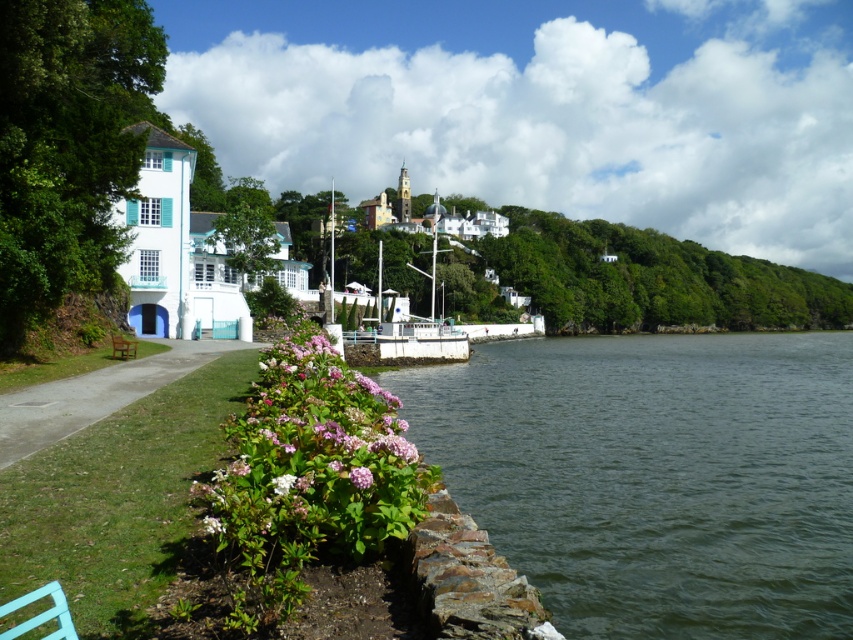
Question: Is pink matte hydrangea at center smaller than brown wooden bench at lower left?

Choices:
 (A) yes
 (B) no

Answer: (B)

Question: Is brown wooden bench at lower left behind purple matte hydrangea at center?

Choices:
 (A) no
 (B) yes

Answer: (B)

Question: Which point is farther to the camera?

Choices:
 (A) (76, 378)
 (B) (219, 522)
 (C) (546, 378)
 (D) (363, 467)

Answer: (C)

Question: Estimate the real-world distances between objects in this image. Which object is farther from the pink matte hydrangea at center?

Choices:
 (A) greenish water at lower right
 (B) purple matte hydrangea at center

Answer: (A)

Question: Does brown wooden bench at lower left lie behind purple matte hydrangea at center?

Choices:
 (A) yes
 (B) no

Answer: (A)

Question: Among these points, which one is farthest from the camera?

Choices:
 (A) (367, 484)
 (B) (215, 525)

Answer: (A)